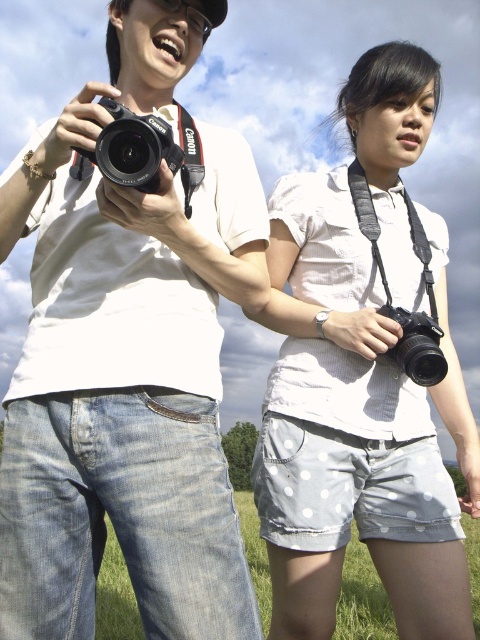
Which of these two, matte black camera at left or white dotted shorts at center, stands taller?

With more height is white dotted shorts at center.

Identify the location of matte black camera at left. (128, 358).

What are the coordinates of `matte black camera at left` in the screenshot? It's located at (128, 358).

Which is above, matte black camera at left or green grass at lower center?

matte black camera at left

Between matte black camera at left and green grass at lower center, which one is positioned lower?

Positioned lower is green grass at lower center.

In the scene shown: Who is more forward, (x=82, y=340) or (x=381, y=621)?

Point (x=82, y=340)

Identify the location of matte black camera at left. This screenshot has width=480, height=640. (128, 358).

Who is positioned more to the right, white dotted shorts at center or green grass at lower center?

green grass at lower center is more to the right.

Is white dotted shorts at center to the left of green grass at lower center from the viewer's perspective?

Correct, you'll find white dotted shorts at center to the left of green grass at lower center.

Find the location of `white dotted shorts at center`. white dotted shorts at center is located at coordinates (361, 378).

I want to click on white dotted shorts at center, so click(x=361, y=378).